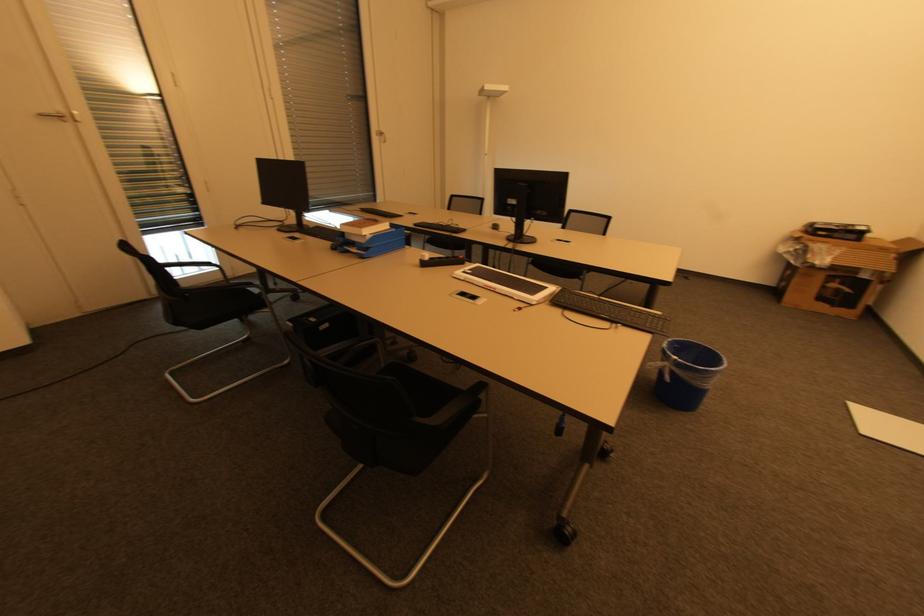
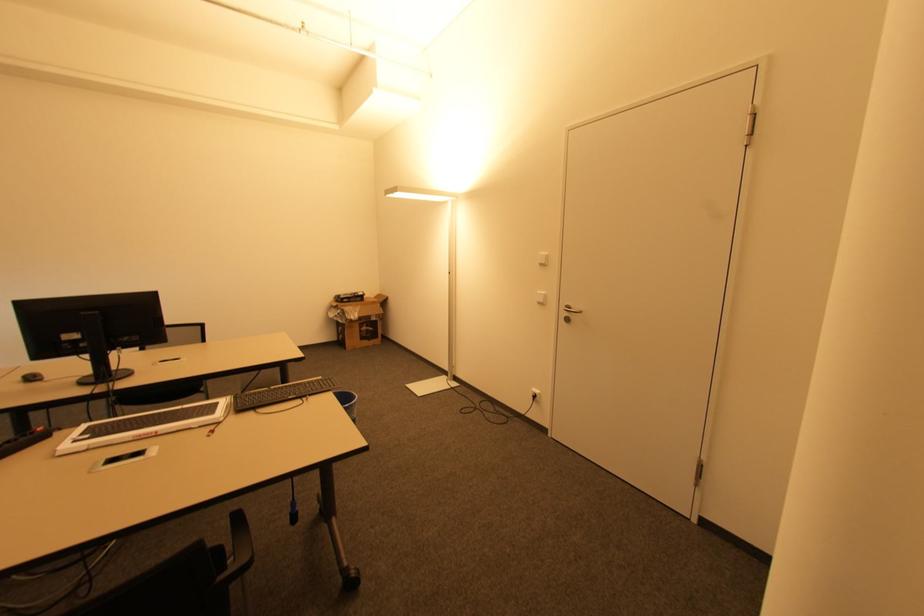
Locate, in the second image, the point that corresponds to point 840,290 in the first image.

(369, 331)